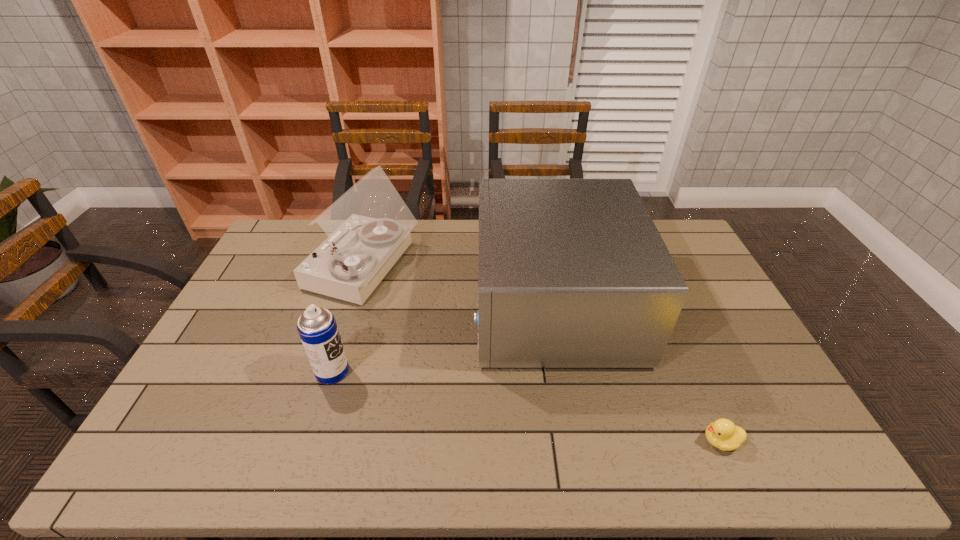
The image size is (960, 540). I want to click on record player, so click(368, 227).

Where is `the second object from right to left`? This screenshot has width=960, height=540. the second object from right to left is located at coordinates (573, 273).

Where is `the third tallest object`? The image size is (960, 540). the third tallest object is located at coordinates (317, 328).

Where is `the rightmost object`? the rightmost object is located at coordinates (722, 433).

Locate an element on the screen. Image resolution: width=960 pixels, height=540 pixels. duckling is located at coordinates [x=722, y=433].

Find the location of a particular element. This screenshot has width=960, height=540. vacant space located 0.050m on the right of the record player is located at coordinates (431, 267).

Where is `vacant area situated with the door open on the second object from right to left`? The width and height of the screenshot is (960, 540). vacant area situated with the door open on the second object from right to left is located at coordinates (407, 303).

Find the location of a particular element. The image size is (960, 540). vacant space positioned with the door open on the second object from right to left is located at coordinates (460, 303).

You are a GUI agent. You are given a task and a screenshot of the screen. Output one action in this format:
    pyautogui.click(x=<x>, y=<y>)
    Task: Click on the free space located 0.130m with the door open on the second object from right to left
    Image resolution: width=960 pixels, height=540 pixels.
    Given the screenshot: What is the action you would take?
    pyautogui.click(x=435, y=303)

The width and height of the screenshot is (960, 540). In order to click on free point located 0.280m on the label side of the aerosol can in this screenshot , I will do `click(450, 372)`.